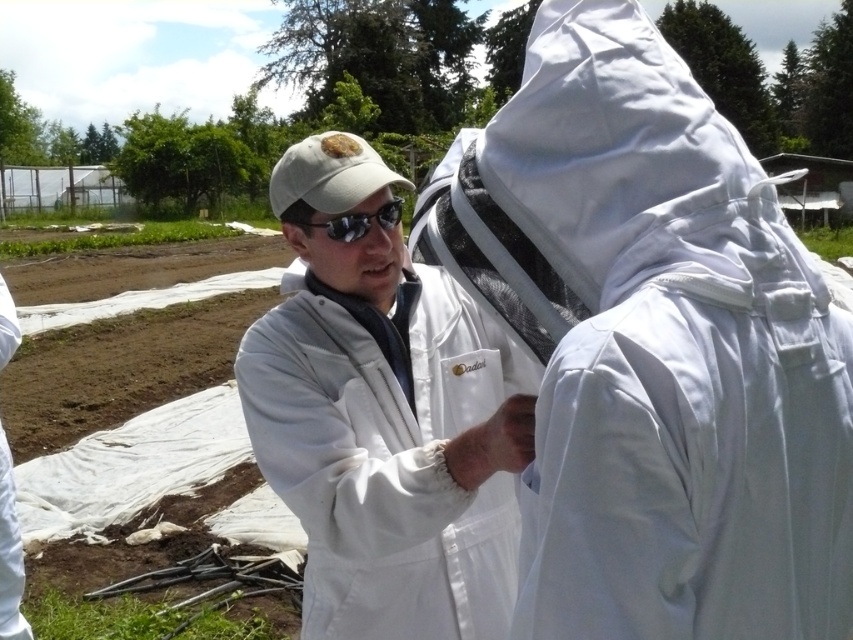
You are a drone operator trying to capture a photo of the beekeeper in the center. The drone has a camera with a 100mm lens that can focus on objects within a 0.5m radius. The point at coordinates (653,346) marks the center of the beekeeper. If the drone is currently 2 meters away from the beekeeper, will the beekeeper be in focus?

The point at (653,346) indicates the white fabric beekeeping suit at center. Since the drone is 2 meters away and the lens focuses within 0.5m radius, the beekeeper will not be in focus as the distance exceeds the lens capability.

You are standing at the origin point in the image. Which of the two points, point [717,230] or point [335,417], is closer to you?

Point [717,230] is in front of point [335,417], so it is closer to you.

Looking at this image, you are a photographer planning to take a portrait of the person in the white fabric beekeeping suit at center. The camera you are using has a focal length of 50mm. To ensure the entire suit fits in the frame, you need to position yourself at least 2 meters away. Based on the coordinates provided, is this distance sufficient?

The white fabric beekeeping suit at center is located at point (653,346). Since the required minimum distance is 2 meters, and the coordinates do not provide information about the actual size or distance from the camera, it is not possible to determine if 2 meters is sufficient based solely on the given coordinates.